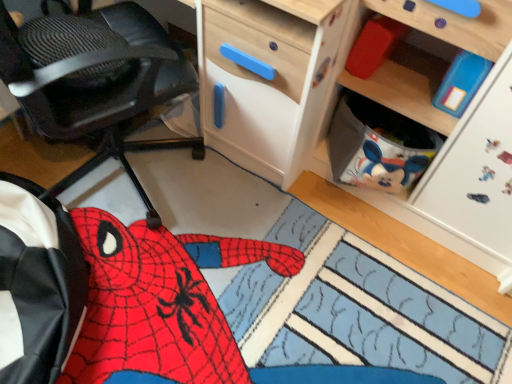
Question: Is black textured office chair at left aimed at matte red block at upper right?

Choices:
 (A) no
 (B) yes

Answer: (B)

Question: From the image's perspective, does black textured office chair at left appear higher than matte red block at upper right?

Choices:
 (A) yes
 (B) no

Answer: (B)

Question: Is black textured office chair at left at the left side of matte red block at upper right?

Choices:
 (A) yes
 (B) no

Answer: (A)

Question: Does black textured office chair at left come behind matte red block at upper right?

Choices:
 (A) yes
 (B) no

Answer: (B)

Question: Is matte red block at upper right inside black textured office chair at left?

Choices:
 (A) no
 (B) yes

Answer: (A)

Question: Is black textured office chair at left positioned with its back to matte red block at upper right?

Choices:
 (A) yes
 (B) no

Answer: (B)

Question: From the image's perspective, is wooden cabinet at upper right under matte red block at upper right?

Choices:
 (A) no
 (B) yes

Answer: (B)

Question: Can you confirm if wooden cabinet at upper right is thinner than matte red block at upper right?

Choices:
 (A) no
 (B) yes

Answer: (A)

Question: Is the depth of wooden cabinet at upper right greater than that of matte red block at upper right?

Choices:
 (A) no
 (B) yes

Answer: (A)

Question: Does wooden cabinet at upper right have a greater width compared to matte red block at upper right?

Choices:
 (A) yes
 (B) no

Answer: (A)

Question: Is wooden cabinet at upper right smaller than matte red block at upper right?

Choices:
 (A) yes
 (B) no

Answer: (B)

Question: Is wooden cabinet at upper right at the left side of matte red block at upper right?

Choices:
 (A) no
 (B) yes

Answer: (A)

Question: Are matte red block at upper right and wooden cabinet at upper right far apart?

Choices:
 (A) yes
 (B) no

Answer: (B)